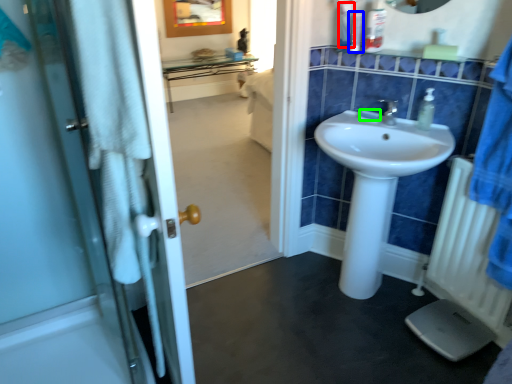
Question: Estimate the real-world distances between objects in this image. Which object is farther from toiletry (highlighted by a red box), toiletry (highlighted by a blue box) or soap (highlighted by a green box)?

Choices:
 (A) toiletry
 (B) soap

Answer: (B)